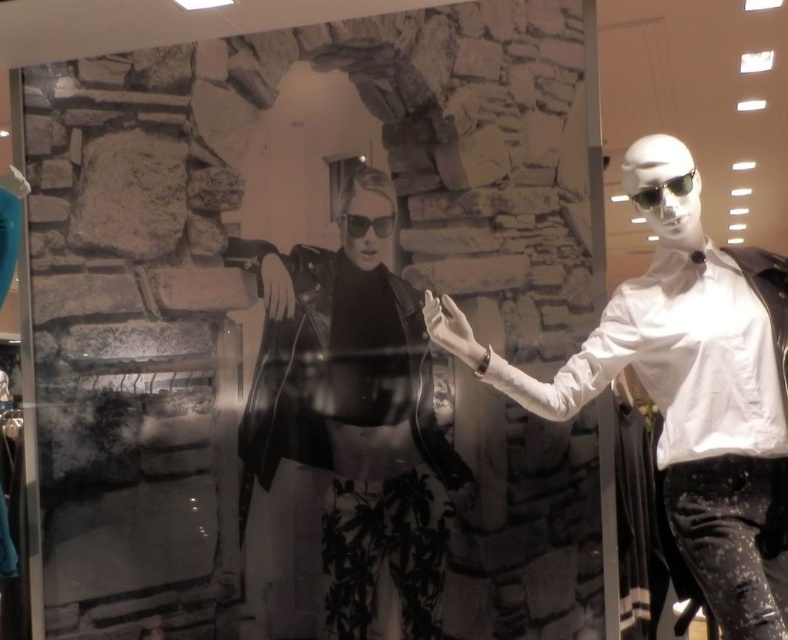
You are a store employee arranging items on a shelf. You have to place the black leather jacket at center and the black matte sunglasses at center side by side. Which item should you place first to ensure they fit properly on the shelf?

The black leather jacket at center should be placed first because it is wider than the black matte sunglasses at center, ensuring there is enough space for both items on the shelf.

You are a store employee who needs to retrieve the black leather jacket at center for a customer. The store requires that you maintain a minimum distance of 6 feet from all items to avoid damaging the reflective floor. Can you safely retrieve the jacket without violating this rule?

The black leather jacket at center is 7.77 feet away from the camera, so yes, you can safely retrieve it while maintaining the required 6 feet distance from the jacket to avoid damaging the reflective floor.